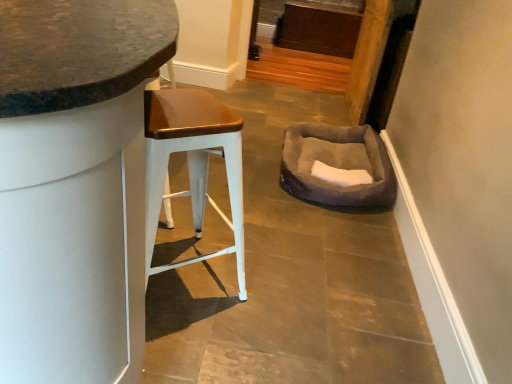
Question: Which is correct: matte white stool at left is inside suede-like gray bean bag at center-right, or outside of it?

Choices:
 (A) inside
 (B) outside

Answer: (B)

Question: In the image, is matte white stool at left positioned in front of or behind suede-like gray bean bag at center-right?

Choices:
 (A) behind
 (B) front

Answer: (B)

Question: Which object is positioned closest to the suede-like gray bean bag at center-right?

Choices:
 (A) matte white stool at left
 (B) white metal stool at left

Answer: (B)

Question: Which object is positioned farthest from the white metal stool at left?

Choices:
 (A) suede-like gray bean bag at center-right
 (B) matte white stool at left

Answer: (A)